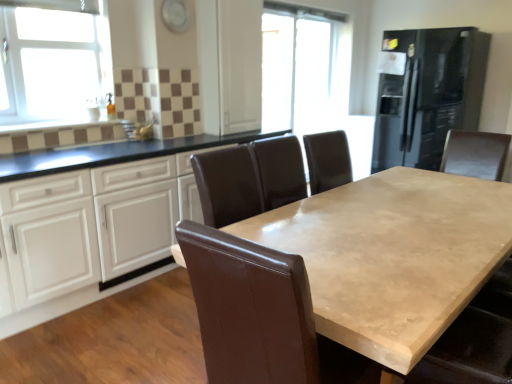
This screenshot has height=384, width=512. In order to click on free space above beige polished wood table at center (from a real-world perspective) in this screenshot , I will do `click(404, 218)`.